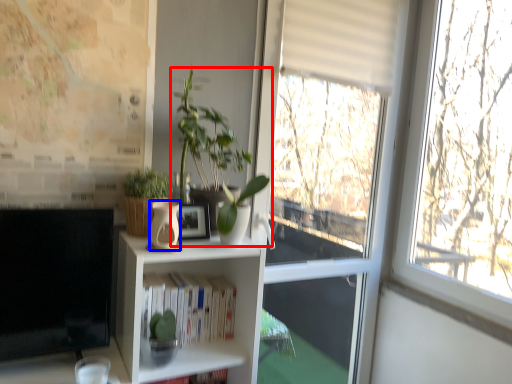
Question: Which point is closer to the camera, houseplant (highlighted by a red box) or vase (highlighted by a blue box)?

Choices:
 (A) houseplant
 (B) vase

Answer: (B)